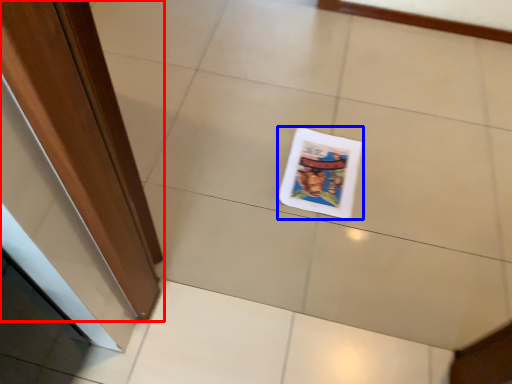
Question: Which of the following is the closest to the observer, door (highlighted by a red box) or magazine (highlighted by a blue box)?

Choices:
 (A) door
 (B) magazine

Answer: (A)